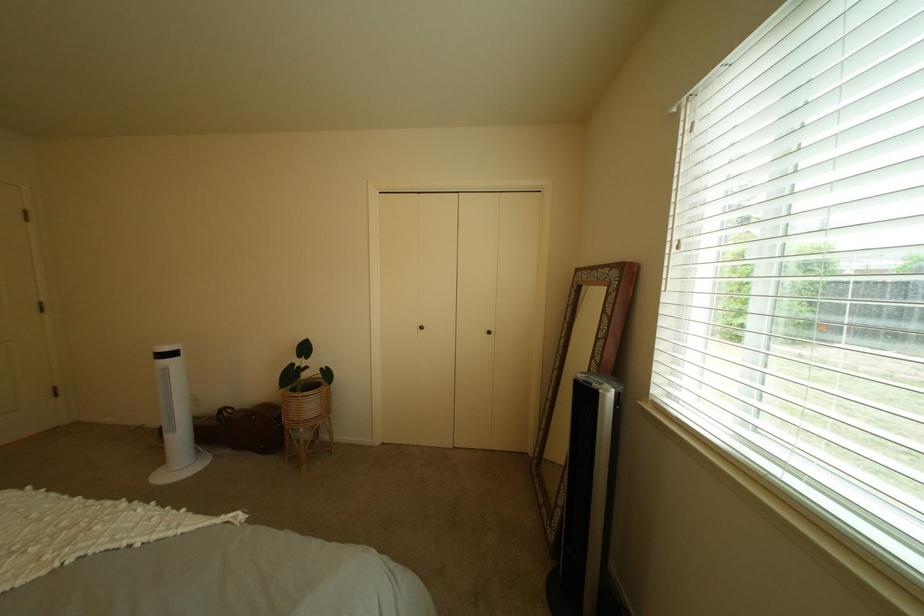
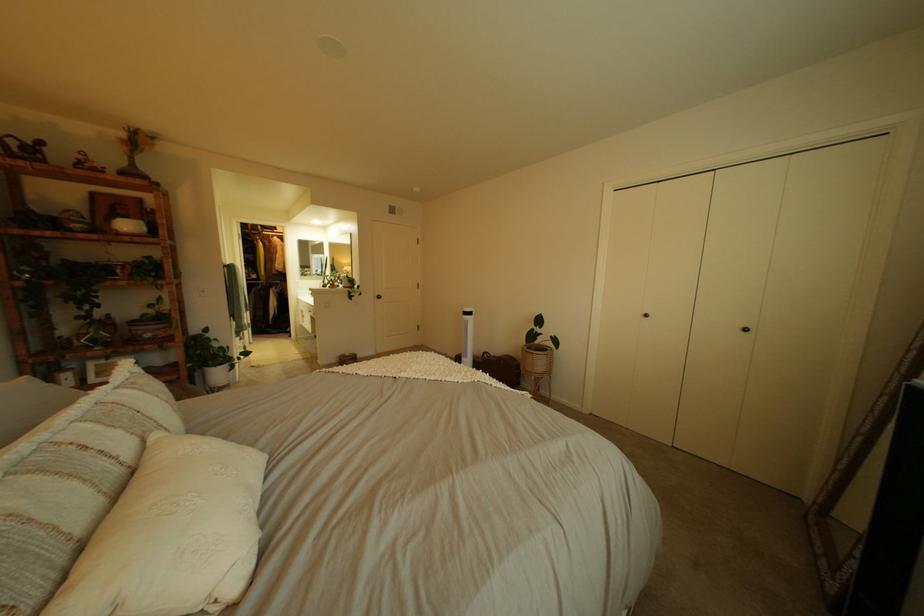
Find the pixel in the second image that matches (438,329) in the first image.

(662, 317)